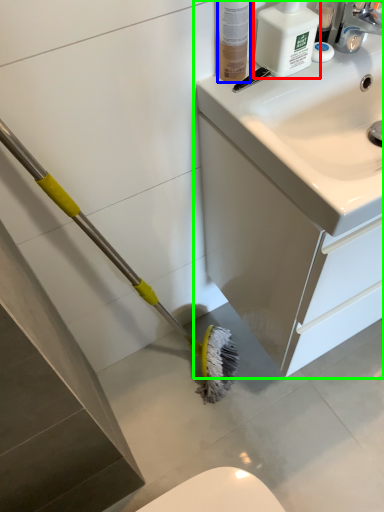
Question: Which object is the farthest from cleaning product (highlighted by a red box)? Choose among these: toiletry (highlighted by a blue box) or bathroom cabinet (highlighted by a green box).

Choices:
 (A) toiletry
 (B) bathroom cabinet

Answer: (B)